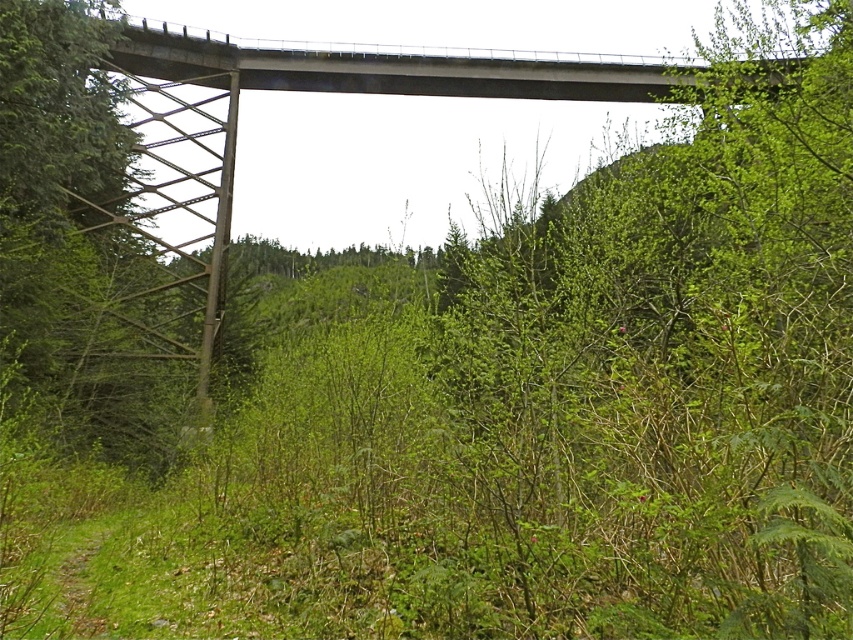
This screenshot has width=853, height=640. What do you see at coordinates (310, 92) in the screenshot?
I see `metallic bridge at center` at bounding box center [310, 92].

Who is higher up, metallic bridge at center or concrete bridge at upper center?

concrete bridge at upper center

At what (x,y) coordinates should I click in order to perform the action: click on metallic bridge at center. Please return your answer as a coordinate pair (x, y). Looking at the image, I should click on (310, 92).